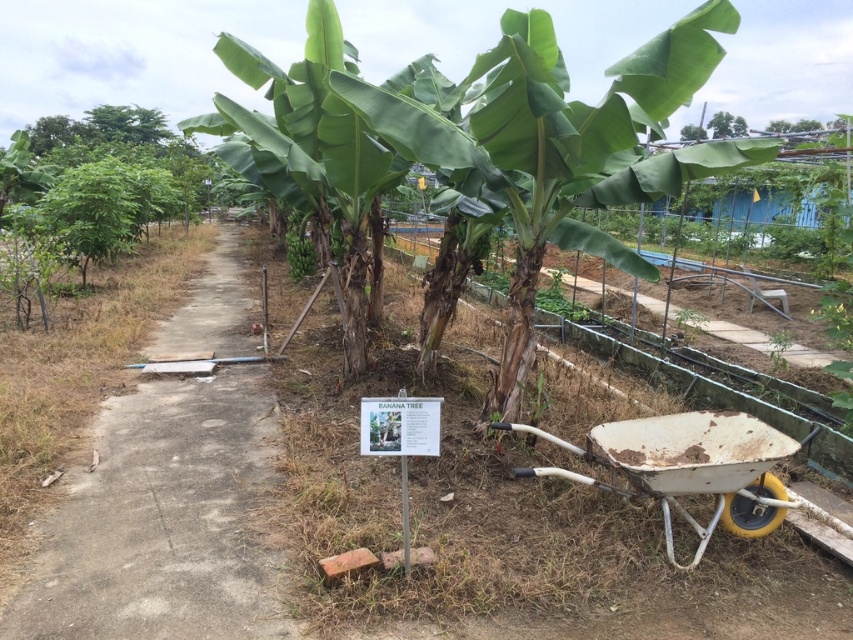
You are standing at the entrance of the banana plantation and see the green leafy tree at upper left and the green leafy banana at center. Which one is positioned more to the left side of the scene?

The green leafy tree at upper left is positioned more to the left side of the scene than the green leafy banana at center.